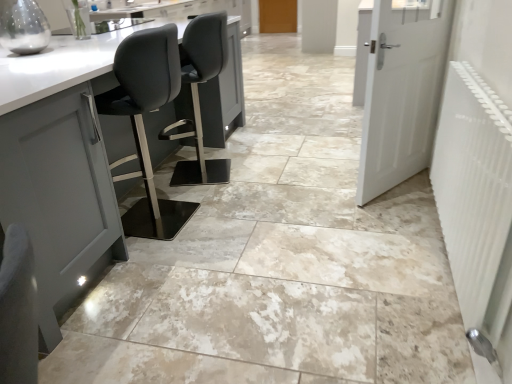
Question: From the image's perspective, is white matte door at right, which is the 2th door from top to bottom, positioned above or below wooden door at center, the 2th door positioned from the bottom?

Choices:
 (A) below
 (B) above

Answer: (A)

Question: Considering the positions of point (415, 66) and point (263, 1), is point (415, 66) closer or farther from the camera than point (263, 1)?

Choices:
 (A) farther
 (B) closer

Answer: (B)

Question: Estimate the real-world distances between objects in this image. Which object is closer to the white matte door at right, which appears as the first door when ordered from the bottom?

Choices:
 (A) wooden door at center, which ranks as the 1th door in top-to-bottom order
 (B) white textured radiator at right

Answer: (B)

Question: Which object is the farthest from the white textured radiator at right?

Choices:
 (A) white matte door at right, which appears as the first door when ordered from the bottom
 (B) wooden door at center, which is the second door from front to back

Answer: (B)